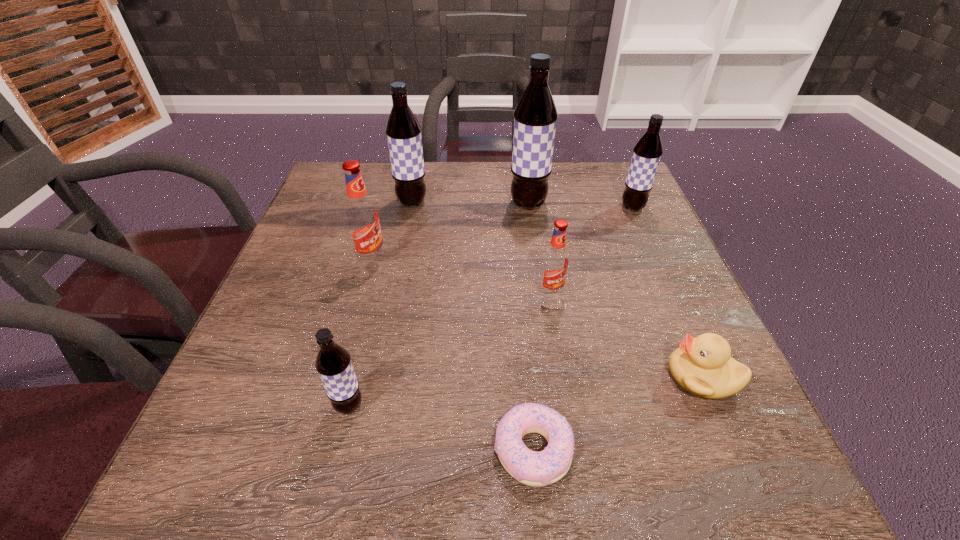
The image size is (960, 540). I want to click on object located in the far right corner section of the desktop, so click(647, 152).

Locate an element on the screen. free space at the far edge is located at coordinates (457, 178).

Locate an element on the screen. vacant area at the near edge of the desktop is located at coordinates (406, 484).

Locate an element on the screen. free space at the left edge is located at coordinates (284, 345).

Where is `free space at the far right corner of the desktop`? This screenshot has height=540, width=960. free space at the far right corner of the desktop is located at coordinates (605, 183).

Find the location of a particular element. This screenshot has height=540, width=960. free space at the near right corner of the desktop is located at coordinates 711,487.

Image resolution: width=960 pixels, height=540 pixels. I want to click on vacant point located between the duckling and the rightmost root beer, so click(667, 292).

At what (x,y) coordinates should I click in order to perform the action: click on free area in between the rightmost root beer and the smaller red root beer. Please return your answer as a coordinate pair (x, y). Image resolution: width=960 pixels, height=540 pixels. Looking at the image, I should click on (591, 251).

Where is `vacant space in between the pink doughnut and the smallest brown root beer`? vacant space in between the pink doughnut and the smallest brown root beer is located at coordinates (441, 428).

Find the location of `vacant point located between the right red root beer and the doughnut`. vacant point located between the right red root beer and the doughnut is located at coordinates (541, 372).